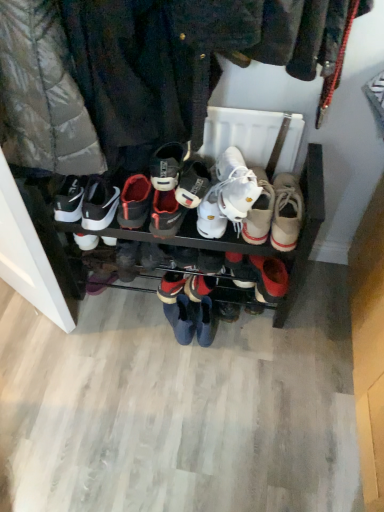
Question: Are white canvas shoe at center, which is the 7th footwear from left to right, and blue suede boots at center, marked as the 5th footwear in a right-to-left arrangement, far apart?

Choices:
 (A) yes
 (B) no

Answer: (B)

Question: Is white canvas shoe at center, which is the 7th footwear from left to right, to the right of blue suede boots at center, marked as the 5th footwear in a right-to-left arrangement, from the viewer's perspective?

Choices:
 (A) yes
 (B) no

Answer: (A)

Question: Is white canvas shoe at center, arranged as the second footwear when viewed from the right, located outside blue suede boots at center, marked as the 5th footwear in a right-to-left arrangement?

Choices:
 (A) no
 (B) yes

Answer: (B)

Question: From the image's perspective, does white canvas shoe at center, arranged as the second footwear when viewed from the right, appear higher than blue suede boots at center, marked as the 5th footwear in a right-to-left arrangement?

Choices:
 (A) no
 (B) yes

Answer: (B)

Question: Is blue suede boots at center, the fourth footwear viewed from the left, at the back of white canvas shoe at center, arranged as the second footwear when viewed from the right?

Choices:
 (A) yes
 (B) no

Answer: (B)

Question: Can you confirm if white canvas shoe at center, arranged as the second footwear when viewed from the right, is taller than blue suede boots at center, the fourth footwear viewed from the left?

Choices:
 (A) yes
 (B) no

Answer: (B)

Question: Is white leather sneakers at center, which is the 4th footwear from right to left, taller than beige canvas shoe at center, marked as the first footwear in a right-to-left arrangement?

Choices:
 (A) yes
 (B) no

Answer: (A)

Question: Does white leather sneakers at center, which is the 4th footwear from right to left, lie in front of beige canvas shoe at center, marked as the first footwear in a right-to-left arrangement?

Choices:
 (A) yes
 (B) no

Answer: (A)

Question: Is white leather sneakers at center, which is the 4th footwear from right to left, with beige canvas shoe at center, marked as the first footwear in a right-to-left arrangement?

Choices:
 (A) yes
 (B) no

Answer: (B)

Question: Is white leather sneakers at center, positioned as the 5th footwear in left-to-right order, behind beige canvas shoe at center, marked as the first footwear in a right-to-left arrangement?

Choices:
 (A) yes
 (B) no

Answer: (B)

Question: Can you confirm if white leather sneakers at center, positioned as the 5th footwear in left-to-right order, is smaller than beige canvas shoe at center, which appears as the 8th footwear when viewed from the left?

Choices:
 (A) yes
 (B) no

Answer: (B)

Question: Is white leather sneakers at center, positioned as the 5th footwear in left-to-right order, facing away from beige canvas shoe at center, marked as the first footwear in a right-to-left arrangement?

Choices:
 (A) no
 (B) yes

Answer: (B)

Question: Considering the relative sizes of white leather sneakers at center, which is counted as the sixth footwear, starting from the left, and blue suede boots at center, the fourth footwear viewed from the left, in the image provided, is white leather sneakers at center, which is counted as the sixth footwear, starting from the left, wider than blue suede boots at center, the fourth footwear viewed from the left,?

Choices:
 (A) no
 (B) yes

Answer: (B)